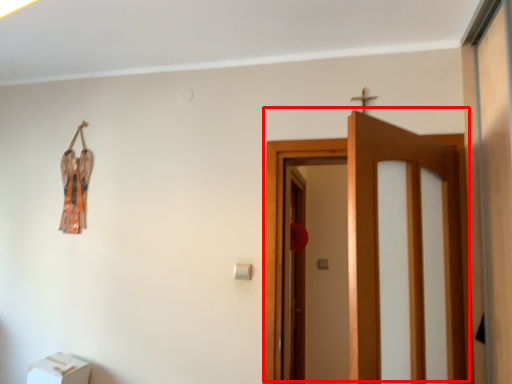
Question: Observing the image, what is the correct spatial positioning of door (annotated by the red box) in reference to furniture?

Choices:
 (A) right
 (B) left

Answer: (A)